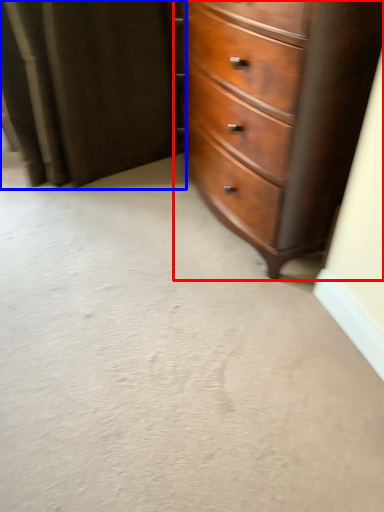
Question: Which of the following is the closest to the observer, chest of drawers (highlighted by a red box) or curtain (highlighted by a blue box)?

Choices:
 (A) chest of drawers
 (B) curtain

Answer: (A)